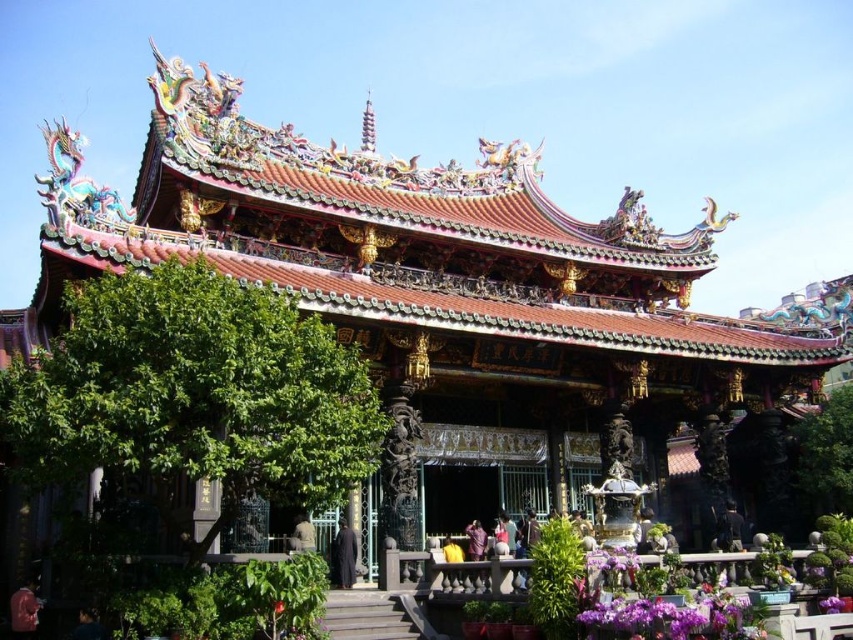
You are standing in front of the traditional Chinese temple and notice a point marked at coordinates (193, 394). What does this point represent?

The point at (193, 394) represents the green leafy tree at left.